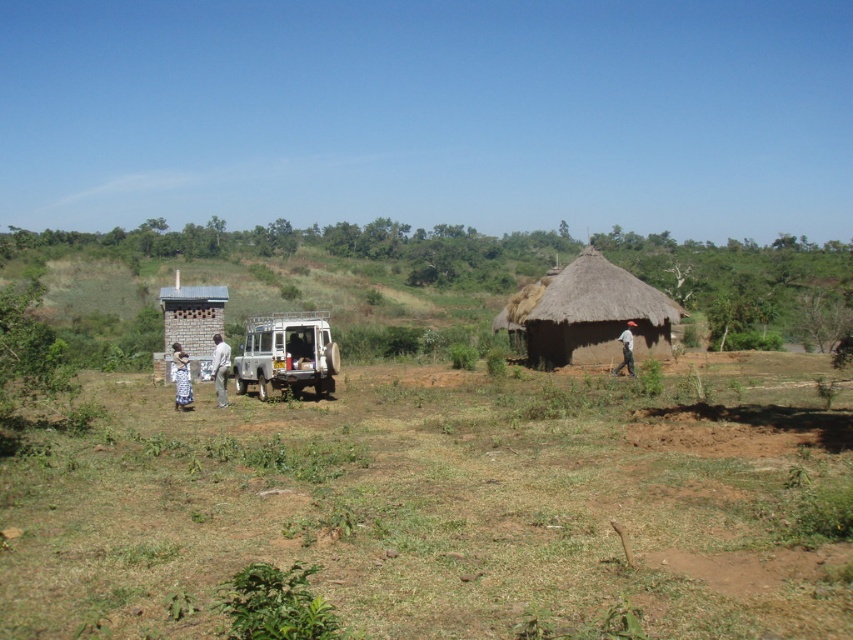
You are a photographer planning to take a portrait of someone wearing the white lace dress at left in front of the thatched straw hut at right. Based on the scene description, will the dress be taller than the hut in the photo?

The thatched straw hut at right has a greater height compared to the white lace dress at left, so in the photo, the hut will appear taller than the dress.